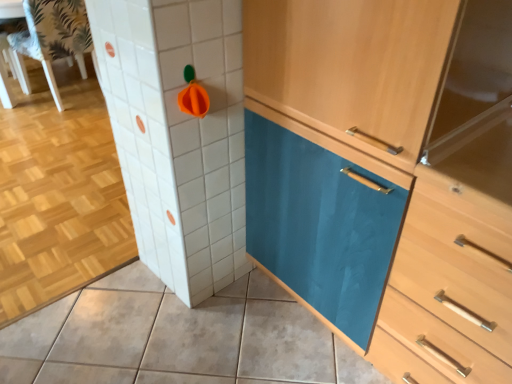
Where is `matte ceramic tile at lower center`? This screenshot has height=384, width=512. matte ceramic tile at lower center is located at coordinates (176, 337).

Describe the element at coordinates (176, 337) in the screenshot. The height and width of the screenshot is (384, 512). I see `matte ceramic tile at lower center` at that location.

Image resolution: width=512 pixels, height=384 pixels. Identify the location of teal glossy cabinet at center. (386, 176).

Image resolution: width=512 pixels, height=384 pixels. Find the location of `white fabric chair at upper left`. white fabric chair at upper left is located at coordinates (51, 40).

In order to click on matte ceramic tile at lower center in this screenshot , I will do `click(176, 337)`.

Considering the sizes of objects light wood/wooden chest of drawers at center and matte ceramic tile at lower center in the image provided, who is taller, light wood/wooden chest of drawers at center or matte ceramic tile at lower center?

Standing taller between the two is light wood/wooden chest of drawers at center.

Could you tell me if light wood/wooden chest of drawers at center is turned towards matte ceramic tile at lower center?

No, light wood/wooden chest of drawers at center is not facing towards matte ceramic tile at lower center.

Does light wood/wooden chest of drawers at center touch matte ceramic tile at lower center?

light wood/wooden chest of drawers at center and matte ceramic tile at lower center are not in contact.

Which object is thinner, light wood/wooden chest of drawers at center or matte ceramic tile at lower center?

Thinner between the two is light wood/wooden chest of drawers at center.

Considering the positions of objects matte ceramic tile at lower center and light wood/wooden chest of drawers at center in the image provided, who is more to the right, matte ceramic tile at lower center or light wood/wooden chest of drawers at center?

light wood/wooden chest of drawers at center.

From the image's perspective, is matte ceramic tile at lower center positioned above or below light wood/wooden chest of drawers at center?

Based on their image positions, matte ceramic tile at lower center is located beneath light wood/wooden chest of drawers at center.

Is matte ceramic tile at lower center positioned with its back to light wood/wooden chest of drawers at center?

No, light wood/wooden chest of drawers at center is not at the back of matte ceramic tile at lower center.

Is matte ceramic tile at lower center outside of light wood/wooden chest of drawers at center?

Yes, matte ceramic tile at lower center is outside of light wood/wooden chest of drawers at center.

This screenshot has width=512, height=384. In order to click on chest of drawers on the right side of white fabric chair at upper left in this screenshot , I will do `click(449, 287)`.

Which is closer, (476, 277) or (75, 1)?

Point (476, 277)

Considering the relative positions of light wood/wooden chest of drawers at center and white fabric chair at upper left in the image provided, is light wood/wooden chest of drawers at center to the left or to the right of white fabric chair at upper left?

Based on their positions, light wood/wooden chest of drawers at center is located to the right of white fabric chair at upper left.

Considering the relative sizes of light wood/wooden chest of drawers at center and white fabric chair at upper left in the image provided, is light wood/wooden chest of drawers at center shorter than white fabric chair at upper left?

In fact, light wood/wooden chest of drawers at center may be taller than white fabric chair at upper left.

Is light wood/wooden chest of drawers at center wider or thinner than teal glossy cabinet at center?

In the image, light wood/wooden chest of drawers at center appears to be more narrow than teal glossy cabinet at center.

Relative to teal glossy cabinet at center, is light wood/wooden chest of drawers at center in front or behind?

In the image, light wood/wooden chest of drawers at center appears in front of teal glossy cabinet at center.

This screenshot has width=512, height=384. I want to click on the chest of drawers beneath the teal glossy cabinet at center (from a real-world perspective), so click(x=449, y=287).

Can you confirm if light wood/wooden chest of drawers at center is positioned to the right of teal glossy cabinet at center?

Indeed, light wood/wooden chest of drawers at center is positioned on the right side of teal glossy cabinet at center.

Considering the positions of objects teal glossy cabinet at center and matte ceramic tile at lower center in the image provided, who is behind, teal glossy cabinet at center or matte ceramic tile at lower center?

matte ceramic tile at lower center is further from the camera.

From the picture: Considering the relative sizes of teal glossy cabinet at center and matte ceramic tile at lower center in the image provided, is teal glossy cabinet at center shorter than matte ceramic tile at lower center?

Incorrect, the height of teal glossy cabinet at center does not fall short of that of matte ceramic tile at lower center.

Which is in front, point (344, 45) or point (49, 328)?

The point (344, 45) is closer to the camera.

In the image, there is a white fabric chair at upper left. Where is `ceramic tile below it (from a real-world perspective)`? ceramic tile below it (from a real-world perspective) is located at coordinates (176, 337).

Between matte ceramic tile at lower center and white fabric chair at upper left, which one has more height?

white fabric chair at upper left is taller.

Based on their sizes in the image, would you say matte ceramic tile at lower center is bigger or smaller than white fabric chair at upper left?

Clearly, matte ceramic tile at lower center is smaller in size than white fabric chair at upper left.

Is point (330, 358) closer or farther from the camera than point (57, 54)?

Point (330, 358) appears to be closer to the viewer than point (57, 54).

From the picture: Would you say white fabric chair at upper left is a long distance from light wood/wooden chest of drawers at center?

Yes, white fabric chair at upper left and light wood/wooden chest of drawers at center are quite far apart.

Is white fabric chair at upper left not within light wood/wooden chest of drawers at center?

white fabric chair at upper left lies outside light wood/wooden chest of drawers at center's area.

Which object is closer to the camera, white fabric chair at upper left or light wood/wooden chest of drawers at center?

light wood/wooden chest of drawers at center is more forward.

There is a matte ceramic tile at lower center. Where is `the chest of drawers above it (from a real-world perspective)`? Image resolution: width=512 pixels, height=384 pixels. the chest of drawers above it (from a real-world perspective) is located at coordinates (449, 287).

The height and width of the screenshot is (384, 512). In the image, there is a light wood/wooden chest of drawers at center. In order to click on ceramic tile below it (from the image's perspective) in this screenshot , I will do `click(176, 337)`.

Which object lies nearer to the anchor point matte ceramic tile at lower center, light wood/wooden chest of drawers at center or white fabric chair at upper left?

light wood/wooden chest of drawers at center is closer to matte ceramic tile at lower center.

Which object lies nearer to the anchor point light wood/wooden chest of drawers at center, teal glossy cabinet at center or white fabric chair at upper left?

teal glossy cabinet at center is positioned closer to the anchor light wood/wooden chest of drawers at center.

From the image, which object appears to be farther from teal glossy cabinet at center, matte ceramic tile at lower center or white fabric chair at upper left?

white fabric chair at upper left is positioned further to the anchor teal glossy cabinet at center.

From the image, which object appears to be nearer to teal glossy cabinet at center, white fabric chair at upper left or matte ceramic tile at lower center?

matte ceramic tile at lower center.

Estimate the real-world distances between objects in this image. Which object is closer to white fabric chair at upper left, light wood/wooden chest of drawers at center or teal glossy cabinet at center?

teal glossy cabinet at center is positioned closer to the anchor white fabric chair at upper left.

From the image, which object appears to be nearer to white fabric chair at upper left, matte ceramic tile at lower center or teal glossy cabinet at center?

The object closer to white fabric chair at upper left is matte ceramic tile at lower center.

From the picture: Estimate the real-world distances between objects in this image. Which object is closer to white fabric chair at upper left, light wood/wooden chest of drawers at center or matte ceramic tile at lower center?

matte ceramic tile at lower center is closer to white fabric chair at upper left.

Considering their positions, is light wood/wooden chest of drawers at center positioned further to teal glossy cabinet at center than white fabric chair at upper left?

white fabric chair at upper left is further to teal glossy cabinet at center.

Locate an element on the screen. The height and width of the screenshot is (384, 512). cabinetry between white fabric chair at upper left and light wood/wooden chest of drawers at center is located at coordinates (386, 176).

Locate an element on the screen. The width and height of the screenshot is (512, 384). cabinetry situated between matte ceramic tile at lower center and light wood/wooden chest of drawers at center from left to right is located at coordinates (386, 176).

At what (x,y) coordinates should I click in order to perform the action: click on ceramic tile located between white fabric chair at upper left and light wood/wooden chest of drawers at center in the left-right direction. Please return your answer as a coordinate pair (x, y). Image resolution: width=512 pixels, height=384 pixels. Looking at the image, I should click on click(x=176, y=337).

Find the location of `ceramic tile between teal glossy cabinet at center and white fabric chair at upper left along the z-axis`. ceramic tile between teal glossy cabinet at center and white fabric chair at upper left along the z-axis is located at coordinates (176, 337).